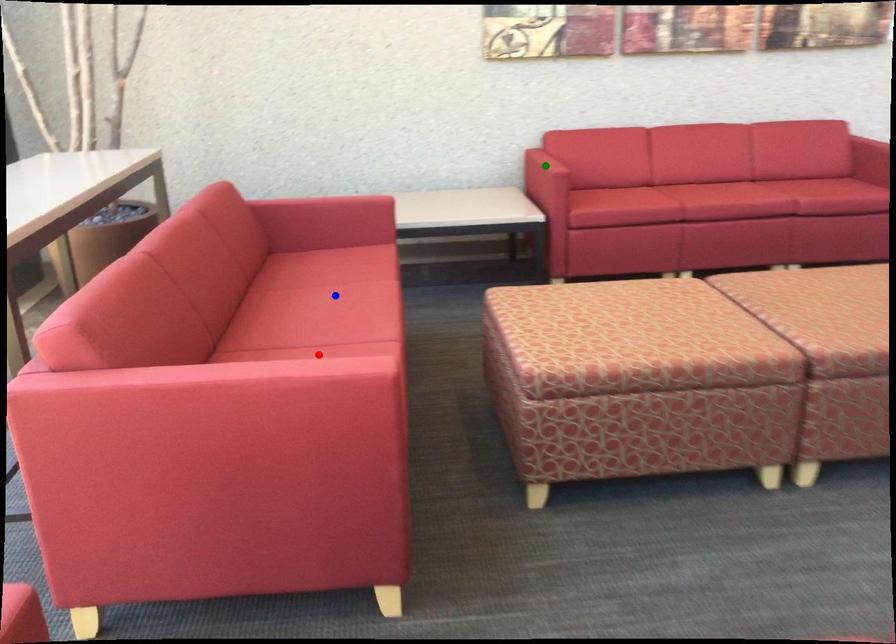
Based on the photo, order these from nearest to farthest:
1. green point
2. red point
3. blue point

green point < blue point < red point